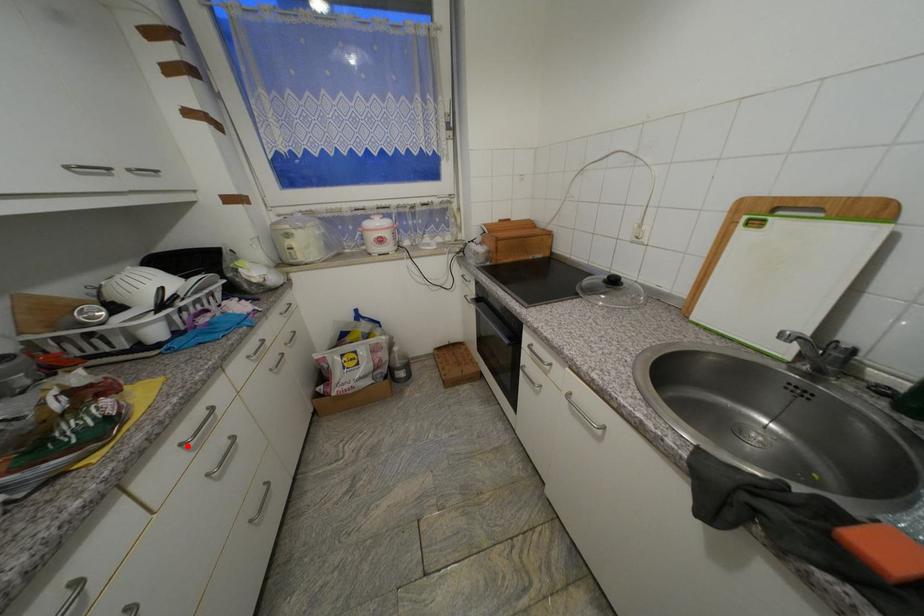
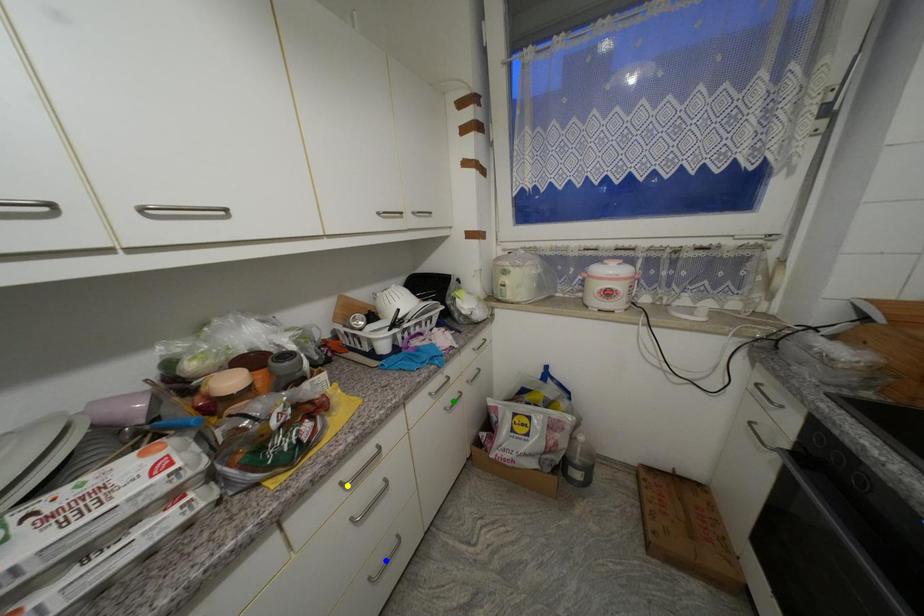
Question: I am providing you with two images of the same scene from different viewpoints. A red point is marked on the first image. You are given multiple points on the second image. Which point in image 2 represents the same 3d spot as the red point in image 1?

Choices:
 (A) green point
 (B) yellow point
 (C) blue point

Answer: (B)